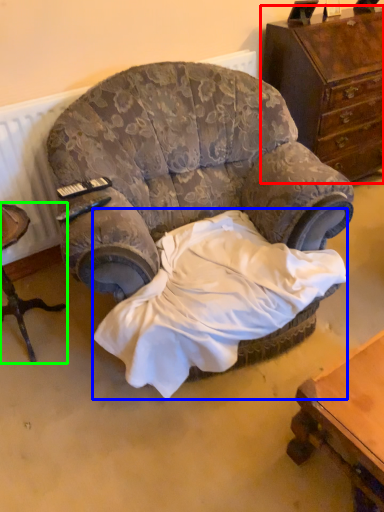
Question: Estimate the real-world distances between objects in this image. Which object is farther from chest of drawers (highlighted by a red box), sheet (highlighted by a blue box) or furniture (highlighted by a green box)?

Choices:
 (A) sheet
 (B) furniture

Answer: (B)